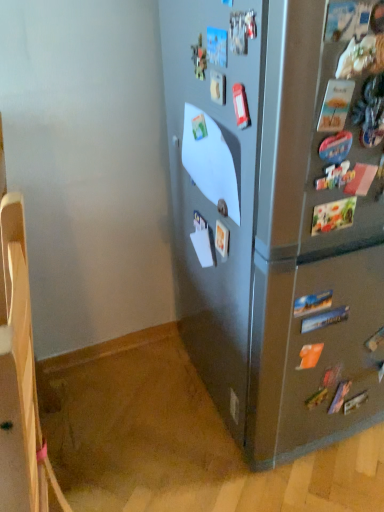
Describe the element at coordinates (280, 212) in the screenshot. I see `satin silver refrigerator at center` at that location.

The width and height of the screenshot is (384, 512). Identify the location of satin silver refrigerator at center. (280, 212).

Identify the location of satin silver refrigerator at center. This screenshot has width=384, height=512. (280, 212).